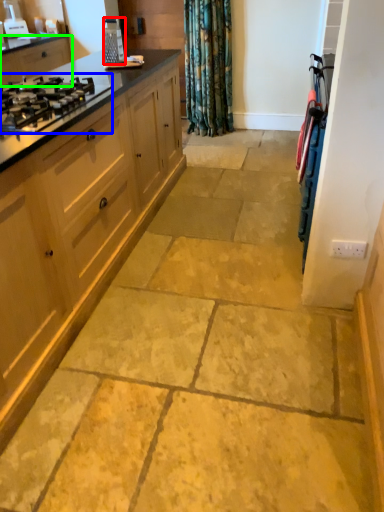
Question: Which is nearer to the appliance (highlighted by a red box)? gas stove (highlighted by a blue box) or cabinetry (highlighted by a green box).

Choices:
 (A) gas stove
 (B) cabinetry

Answer: (B)